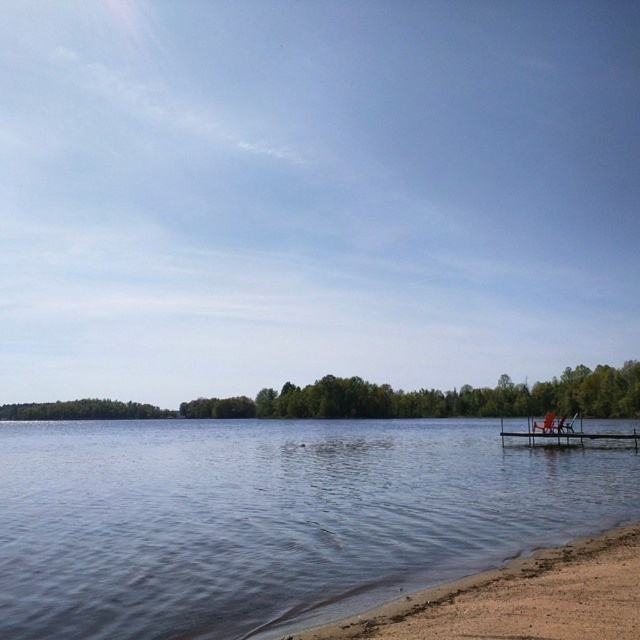
You are standing at the shoreline looking out into the lake. You notice two points marked on the water. The first point is at coordinates point (483,636) and the second is at point (538,420). Which point is closer to you?

Point (483,636) is closer to you because it is in front of point (538,420).

You are standing on the brown sandy beach at lower right and want to reach the brown wooden dock at lower right. Which direction should you walk to get there?

Since the brown sandy beach at lower right has a smaller size compared to the brown wooden dock at lower right, you should walk towards the larger structure to reach the brown wooden dock at lower right.